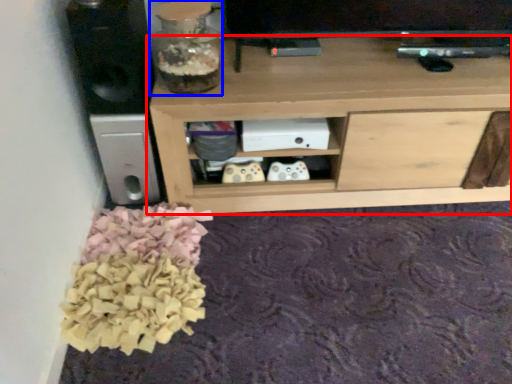
Question: Among these objects, which one is nearest to the camera, shelf (highlighted by a red box) or glass vase (highlighted by a blue box)?

Choices:
 (A) shelf
 (B) glass vase

Answer: (B)